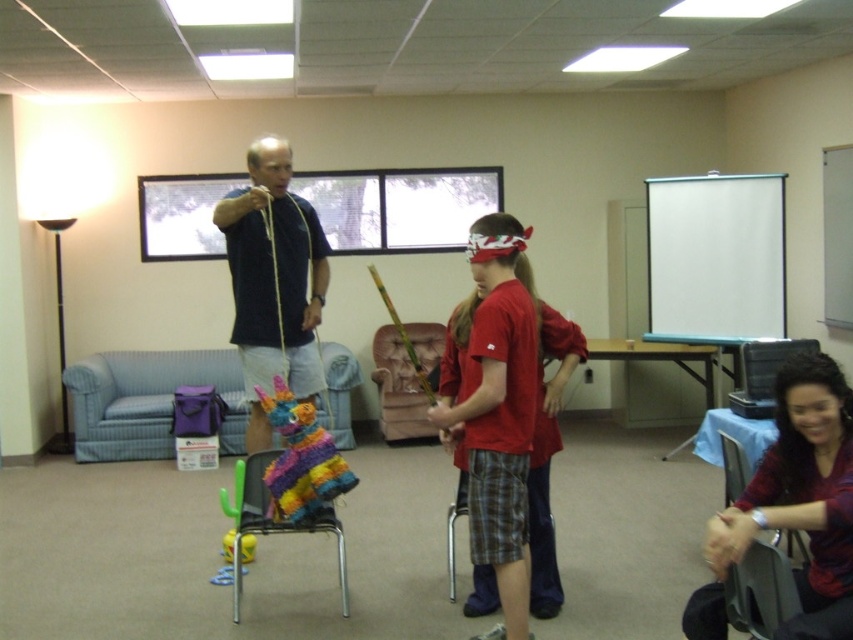
Based on the photo, you are a guest at a party and want to sit down. There is a multicolored paper pinata at center and a velvet pink armchair at center. Which one is lower and can you sit on?

The velvet pink armchair at center is lower than the multicolored paper pinata at center, so you can sit on the velvet pink armchair at center.

You are a decorator planning to replace the multicolored paper pinata at center and the velvet pink armchair at center with new items. If you want to keep the same spatial arrangement, which object should you choose a wider version of?

Since the multicolored paper pinata at center is narrower than the velvet pink armchair at center, you should choose a wider version of the multicolored paper pinata at center to maintain the spatial arrangement.